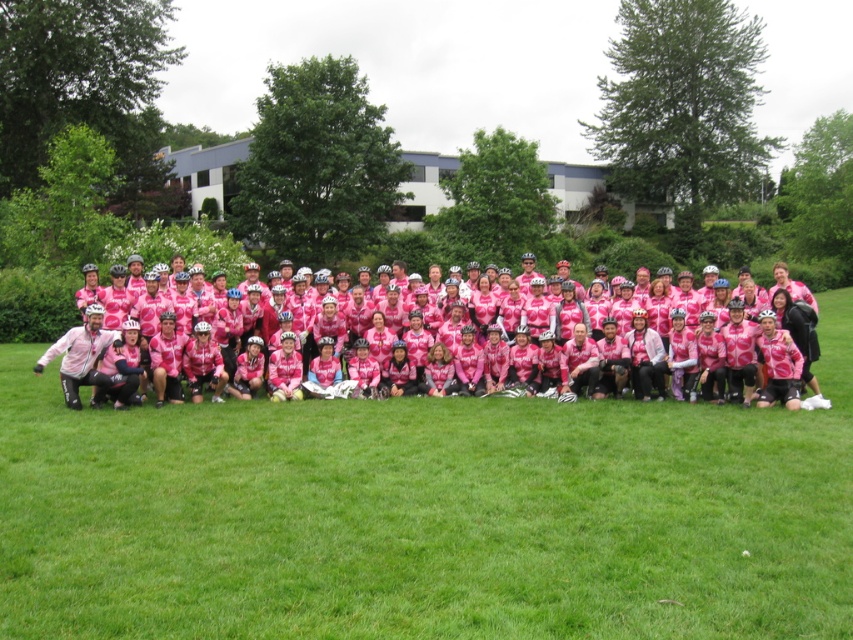
Question: Can you confirm if green grass at center is positioned above pink matte cycling jersey at center?

Choices:
 (A) no
 (B) yes

Answer: (A)

Question: Is the position of green grass at center more distant than that of pink matte cycling jersey at center?

Choices:
 (A) no
 (B) yes

Answer: (A)

Question: Which point appears closest to the camera in this image?

Choices:
 (A) (53, 307)
 (B) (421, 595)

Answer: (B)

Question: Which point appears farthest from the camera in this image?

Choices:
 (A) (552, 538)
 (B) (33, 326)

Answer: (B)

Question: Does green grass at center come in front of pink matte cycling jersey at center?

Choices:
 (A) no
 (B) yes

Answer: (B)